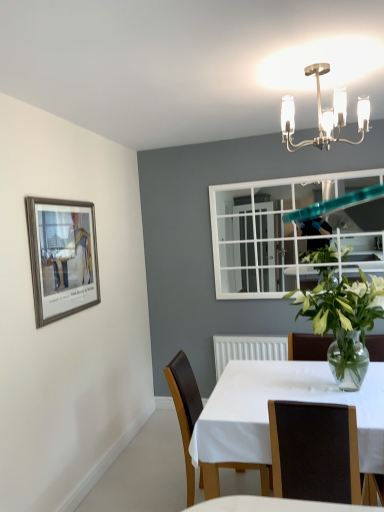
The width and height of the screenshot is (384, 512). What do you see at coordinates (315, 452) in the screenshot?
I see `brown leather chair at center, the 1th chair viewed from the front` at bounding box center [315, 452].

Locate an element on the screen. This screenshot has width=384, height=512. brown leather chair at center, positioned as the 2th chair in front-to-back order is located at coordinates point(185,408).

Find the location of a particular element. white glossy table at center is located at coordinates (268, 416).

Considering the relative sizes of brown leather chair at center, the second chair viewed from the back, and clear glass vase at center in the image provided, is brown leather chair at center, the second chair viewed from the back, shorter than clear glass vase at center?

In fact, brown leather chair at center, the second chair viewed from the back, may be taller than clear glass vase at center.

Can you see brown leather chair at center, the 1th chair viewed from the front, touching clear glass vase at center?

No, brown leather chair at center, the 1th chair viewed from the front, is not with clear glass vase at center.

What's the angular difference between brown leather chair at center, the 1th chair viewed from the front, and clear glass vase at center's facing directions?

The angular difference between brown leather chair at center, the 1th chair viewed from the front, and clear glass vase at center is 178 degrees.

From a real-world perspective, count 1st chairs downward from the clear glass vase at center and point to it. Please provide its 2D coordinates.

[(315, 452)]

From a real-world perspective, does brown leather chair at center, the 1th chair viewed from the front, sit lower than silver metallic picture frame at upper left?

Indeed, from a real-world perspective, brown leather chair at center, the 1th chair viewed from the front, is positioned beneath silver metallic picture frame at upper left.

Is brown leather chair at center, the 1th chair viewed from the front, turned away from silver metallic picture frame at upper left?

That's not correct — brown leather chair at center, the 1th chair viewed from the front, is not looking away from silver metallic picture frame at upper left.

This screenshot has width=384, height=512. I want to click on picture frame located above the brown leather chair at center, the second chair viewed from the back (from the image's perspective), so click(62, 257).

Which of these two, brown leather chair at center, the 1th chair viewed from the front, or silver metallic picture frame at upper left, stands taller?

silver metallic picture frame at upper left.

Can you confirm if white glossy table at center is taller than clear glass vase at center?

Indeed, white glossy table at center has a greater height compared to clear glass vase at center.

From the image's perspective, between white glossy table at center and clear glass vase at center, which one is located above?

clear glass vase at center.

Is white glossy table at center located outside clear glass vase at center?

white glossy table at center is positioned outside clear glass vase at center.

Can you tell me how much white glossy table at center and clear glass vase at center differ in facing direction?

They differ by 0.000307 degrees in their facing directions.

From a real-world perspective, is polished brass chandelier at upper center physically located above or below brown leather chair at center, placed as the first chair when sorted from back to front?

polished brass chandelier at upper center is above brown leather chair at center, placed as the first chair when sorted from back to front.

Which is behind, point (340, 99) or point (185, 390)?

Positioned behind is point (340, 99).

Identify the location of light fixture above the brown leather chair at center, placed as the first chair when sorted from back to front (from a real-world perspective). This screenshot has height=512, width=384. (324, 115).

How many degrees apart are the facing directions of polished brass chandelier at upper center and brown leather chair at center, placed as the first chair when sorted from back to front?

91.9 degrees separate the facing orientations of polished brass chandelier at upper center and brown leather chair at center, placed as the first chair when sorted from back to front.

Is brown leather chair at center, placed as the first chair when sorted from back to front, not inside polished brass chandelier at upper center?

Yes, brown leather chair at center, placed as the first chair when sorted from back to front, is outside of polished brass chandelier at upper center.

In the image, is brown leather chair at center, placed as the first chair when sorted from back to front, positioned in front of or behind polished brass chandelier at upper center?

brown leather chair at center, placed as the first chair when sorted from back to front, is positioned farther from the viewer than polished brass chandelier at upper center.

Considering the relative sizes of brown leather chair at center, positioned as the 2th chair in front-to-back order, and polished brass chandelier at upper center in the image provided, is brown leather chair at center, positioned as the 2th chair in front-to-back order, taller than polished brass chandelier at upper center?

Yes.

Does brown leather chair at center, placed as the first chair when sorted from back to front, have a smaller size compared to silver metallic picture frame at upper left?

No, brown leather chair at center, placed as the first chair when sorted from back to front, is not smaller than silver metallic picture frame at upper left.

Is brown leather chair at center, placed as the first chair when sorted from back to front, to the left of silver metallic picture frame at upper left from the viewer's perspective?

No, brown leather chair at center, placed as the first chair when sorted from back to front, is not to the left of silver metallic picture frame at upper left.

Is brown leather chair at center, positioned as the 2th chair in front-to-back order, beside silver metallic picture frame at upper left?

No, brown leather chair at center, positioned as the 2th chair in front-to-back order, is not touching silver metallic picture frame at upper left.

From a real-world perspective, between brown leather chair at center, positioned as the 2th chair in front-to-back order, and silver metallic picture frame at upper left, who is vertically lower?

In real-world perspective, brown leather chair at center, positioned as the 2th chair in front-to-back order, is lower.

Who is shorter, silver metallic picture frame at upper left or brown leather chair at center, placed as the first chair when sorted from back to front?

silver metallic picture frame at upper left.

Are silver metallic picture frame at upper left and brown leather chair at center, positioned as the 2th chair in front-to-back order, far apart?

silver metallic picture frame at upper left is actually quite close to brown leather chair at center, positioned as the 2th chair in front-to-back order.

Is brown leather chair at center, placed as the first chair when sorted from back to front, at the back of silver metallic picture frame at upper left?

No, brown leather chair at center, placed as the first chair when sorted from back to front, is not at the back of silver metallic picture frame at upper left.

Looking at this image, could brown leather chair at center, positioned as the 2th chair in front-to-back order, be considered to be inside silver metallic picture frame at upper left?

No, brown leather chair at center, positioned as the 2th chair in front-to-back order, is not surrounded by silver metallic picture frame at upper left.

You are a GUI agent. You are given a task and a screenshot of the screen. Output one action in this format:
    pyautogui.click(x=<x>, y=<y>)
    Task: Click on the houseplant positioned vertically above the brown leather chair at center, the 1th chair viewed from the front (from a real-world perspective)
    
    Given the screenshot: What is the action you would take?
    pyautogui.click(x=343, y=320)

Locate an element on the screen. picture frame behind the brown leather chair at center, the 1th chair viewed from the front is located at coordinates (62, 257).

When comparing their distances from white glossy table at center, does brown leather chair at center, positioned as the 2th chair in front-to-back order, or clear glass vase at center seem further?

clear glass vase at center.

Which object lies further to the anchor point polished brass chandelier at upper center, clear glass vase at center or white glossy table at center?

Based on the image, white glossy table at center appears to be further to polished brass chandelier at upper center.

Looking at the image, which one is located further to brown leather chair at center, placed as the first chair when sorted from back to front, silver metallic picture frame at upper left or white glossy table at center?

Based on the image, silver metallic picture frame at upper left appears to be further to brown leather chair at center, placed as the first chair when sorted from back to front.

From the picture: Which object lies nearer to the anchor point brown leather chair at center, the second chair viewed from the back, brown leather chair at center, placed as the first chair when sorted from back to front, or silver metallic picture frame at upper left?

Based on the image, brown leather chair at center, placed as the first chair when sorted from back to front, appears to be nearer to brown leather chair at center, the second chair viewed from the back.

When comparing their distances from brown leather chair at center, the second chair viewed from the back, does silver metallic picture frame at upper left or brown leather chair at center, placed as the first chair when sorted from back to front, seem further?

silver metallic picture frame at upper left is positioned further to the anchor brown leather chair at center, the second chair viewed from the back.

From the image, which object appears to be farther from polished brass chandelier at upper center, white glossy table at center or brown leather chair at center, positioned as the 2th chair in front-to-back order?

brown leather chair at center, positioned as the 2th chair in front-to-back order, is positioned further to the anchor polished brass chandelier at upper center.

Considering their positions, is clear glass vase at center positioned further to white glossy table at center than brown leather chair at center, the second chair viewed from the back?

clear glass vase at center.

Considering their positions, is brown leather chair at center, the second chair viewed from the back, positioned further to white glossy table at center than brown leather chair at center, placed as the first chair when sorted from back to front?

brown leather chair at center, placed as the first chair when sorted from back to front, is further to white glossy table at center.

In order to click on houseplant between polished brass chandelier at upper center and white glossy table at center from top to bottom in this screenshot , I will do `click(343, 320)`.

You are a GUI agent. You are given a task and a screenshot of the screen. Output one action in this format:
    pyautogui.click(x=<x>, y=<y>)
    Task: Click on the picture frame between polished brass chandelier at upper center and white glossy table at center from top to bottom
    The height and width of the screenshot is (512, 384).
    Given the screenshot: What is the action you would take?
    pyautogui.click(x=62, y=257)

In order to click on houseplant between polished brass chandelier at upper center and brown leather chair at center, placed as the first chair when sorted from back to front, in the vertical direction in this screenshot , I will do `click(343, 320)`.

Identify the location of houseplant between polished brass chandelier at upper center and brown leather chair at center, the second chair viewed from the back, in the vertical direction. The height and width of the screenshot is (512, 384). (343, 320).